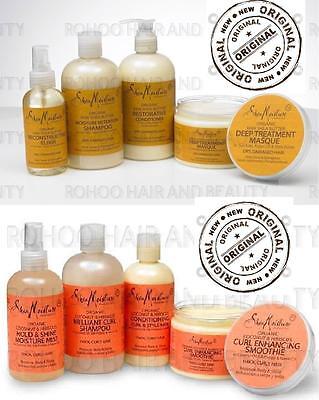
This screenshot has height=400, width=319. Identify the location of bottles. (34, 287), (85, 272), (153, 270), (146, 126), (91, 112), (42, 131).